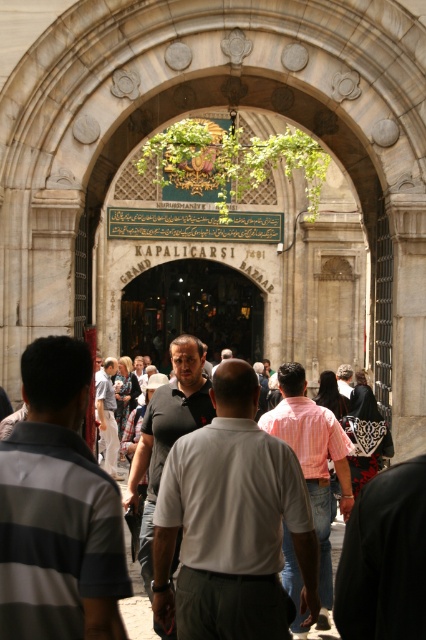
You are a tourist standing at the entrance of the Kapal?car? in Istanbul and notice two shirts displayed at the center. The gray striped shirt at center and the light gray shirt at center. Which one is positioned to the right?

The gray striped shirt at center is positioned to the right of the light gray shirt at center.

You are a tourist standing at the entrance of the Grand Bazaar and notice two shirts displayed in the window of a nearby shop. The shirts are a pink striped shirt at center and a light gray shirt at center. The shopkeeper says you can only choose one shirt to try on based on their distance from each other. If the minimum distance required to comfortably try on a shirt is 120 feet, can you try on either of them?

The distance between the pink striped shirt at center and the light gray shirt at center is 115.61 feet, which is less than the required 120 feet. Therefore, neither shirt can be comfortably tried on due to insufficient space.